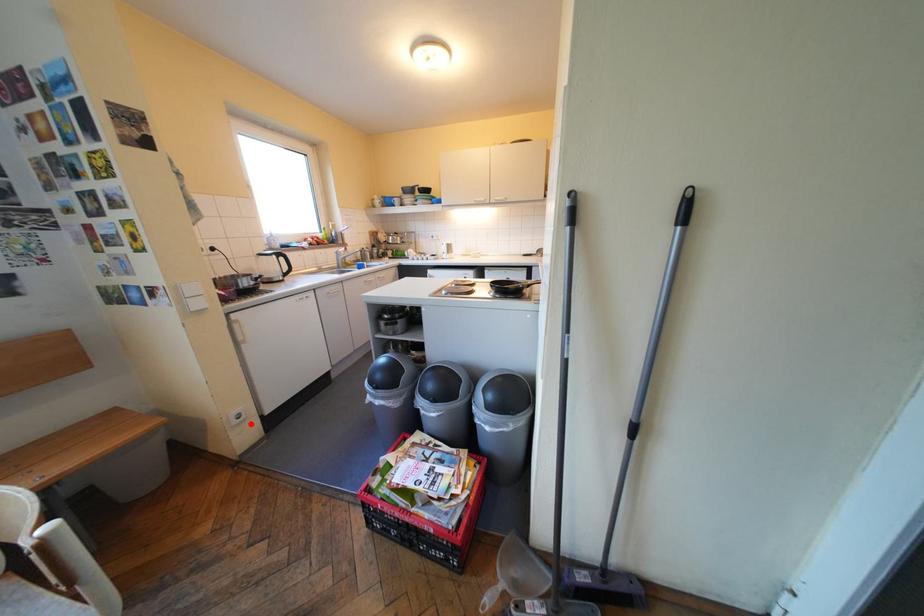
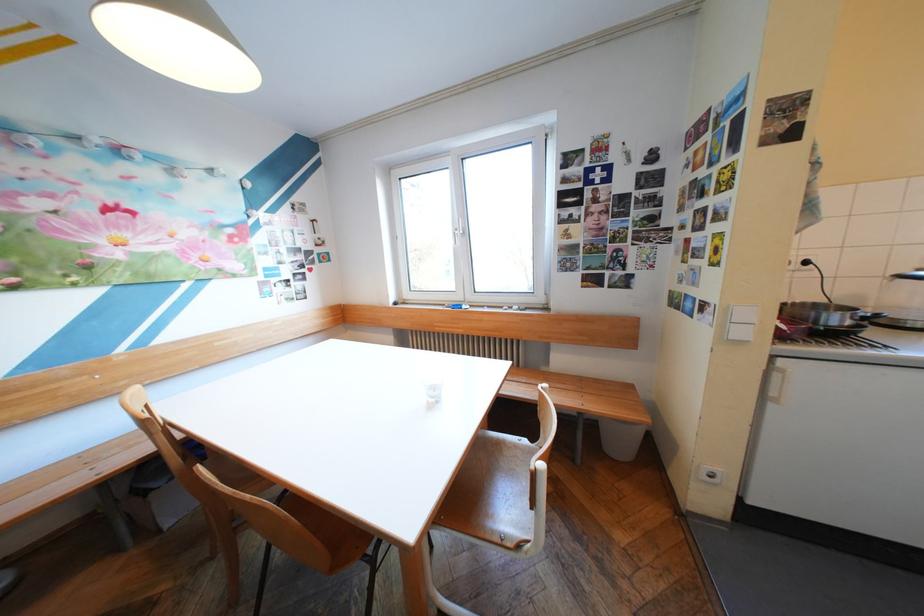
Where in the second image is the point corresponding to the highlighted location from the first image?

(719, 482)